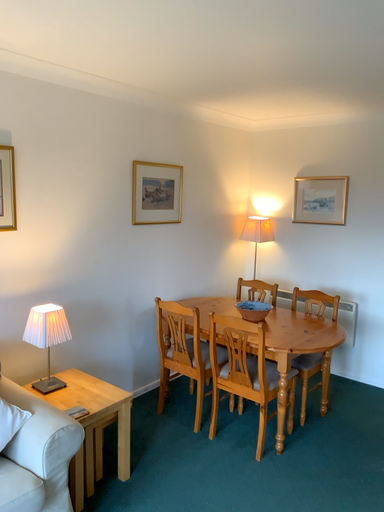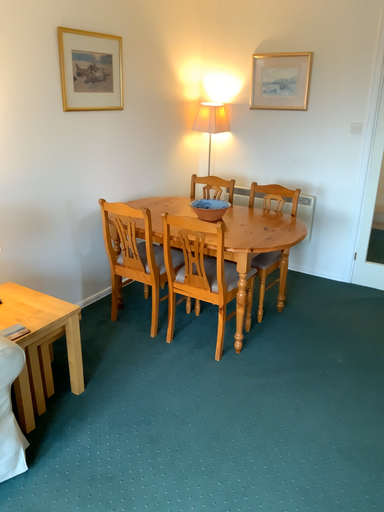
Question: Which way did the camera rotate in the video?

Choices:
 (A) rotated downward
 (B) rotated upward

Answer: (A)